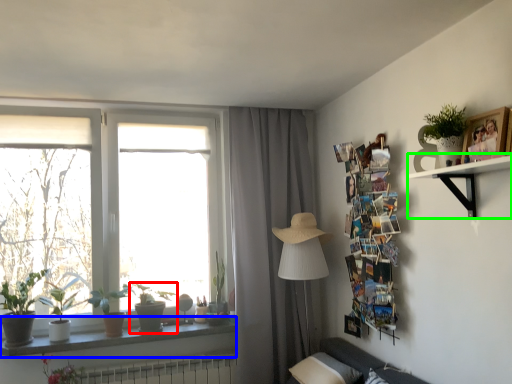
Question: Which object is positioned closest to houseplant (highlighted by a red box)? Select from window sill (highlighted by a blue box) and shelf (highlighted by a green box).

Choices:
 (A) window sill
 (B) shelf

Answer: (A)